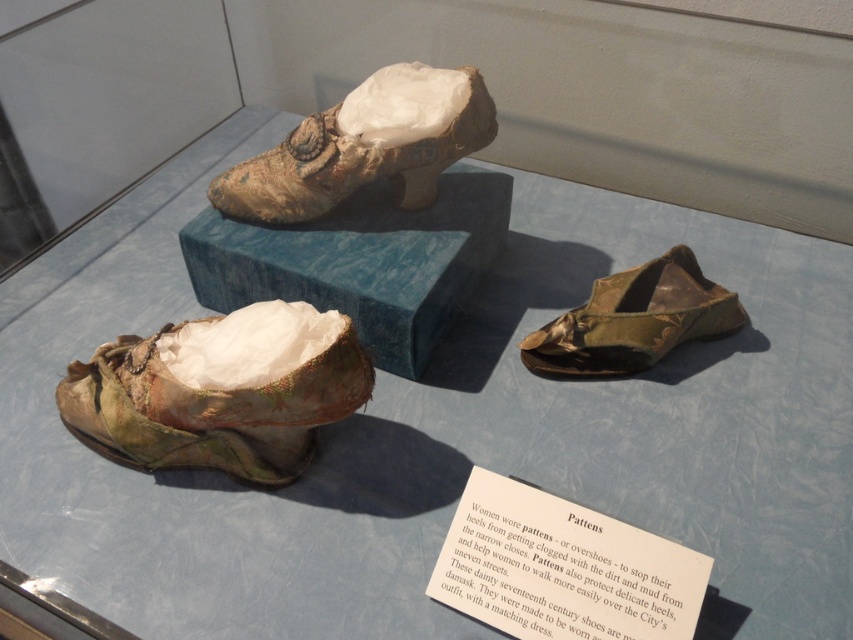
You are a museum visitor standing in front of the display case. You see the matte gold fabric shoe at upper center and the green fabric shoe at lower right. Which shoe is positioned more to the left side of the display?

The matte gold fabric shoe at upper center is positioned to the left of the green fabric shoe at lower right, so it is more to the left side of the display.

You are a museum curator who needs to place a 24 inch wide decorative mat around both the green satin shoe at lower left and the green fabric shoe at lower right. Will the mat fit around both shoes without overlapping?

The distance between the green satin shoe at lower left and the green fabric shoe at lower right is 23.66 inches. Since the mat is 24 inches wide, it will barely fit around both shoes without overlapping, leaving a very small gap between the mat and the shoes.

You are a museum visitor standing in front of the display. You notice two points marked on the pattens. The first point is at coordinates point (320, 186) and the second is at point (733, 310). Which point is closer to you?

Point (320, 186) is in front of point (733, 310), so it is closer to you.